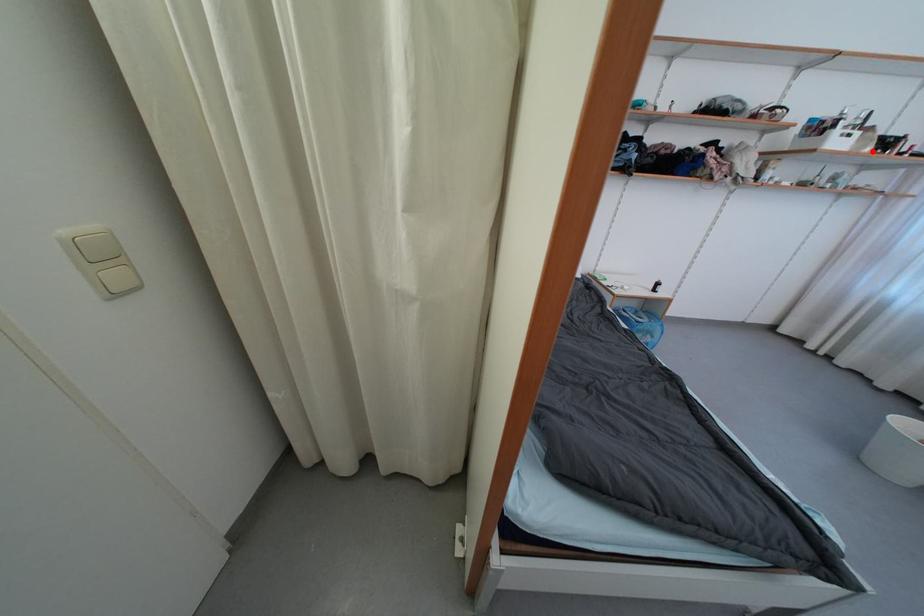
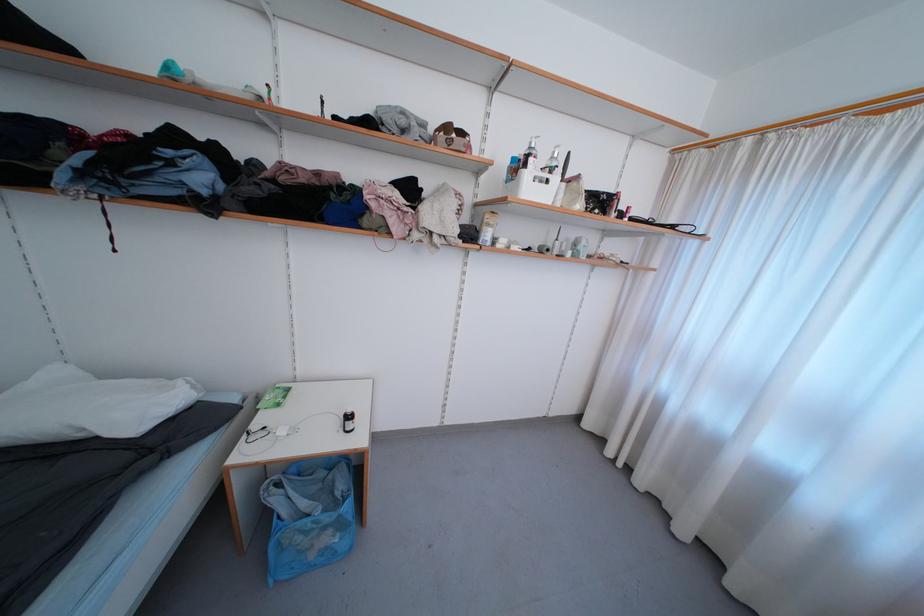
Question: A red point is marked in image1. In image2, is the corresponding 3D point closer to the camera or farther? Reply with the corresponding letter.

Choices:
 (A) The corresponding 3D point is closer.
 (B) The corresponding 3D point is farther.

Answer: (A)